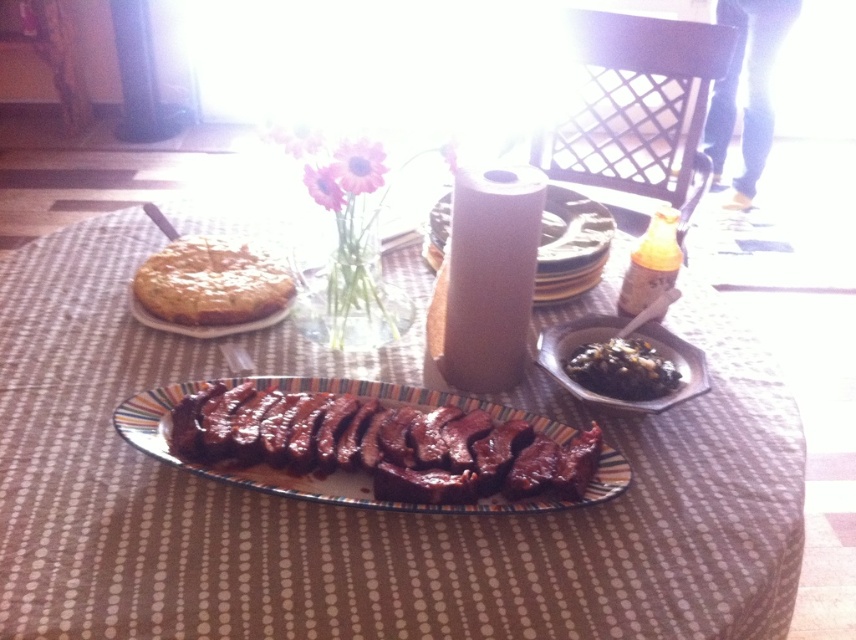
Who is more distant from viewer, [428,508] or [223,282]?

Positioned behind is point [223,282].

Image resolution: width=856 pixels, height=640 pixels. Describe the element at coordinates (334, 472) in the screenshot. I see `glossy ceramic platter at center` at that location.

Locate an element on the screen. glossy ceramic platter at center is located at coordinates (334, 472).

Is point (676, 337) in front of point (223, 332)?

That is True.

Who is more forward, (590, 340) or (146, 323)?

Positioned in front is point (590, 340).

Where is `black glossy bowl at center`? The height and width of the screenshot is (640, 856). black glossy bowl at center is located at coordinates (629, 337).

Where is `smokey brown meat at center`? This screenshot has height=640, width=856. smokey brown meat at center is located at coordinates (367, 509).

Is smokey brown meat at center below black glossy sauce at center?

Yes, smokey brown meat at center is below black glossy sauce at center.

The width and height of the screenshot is (856, 640). I want to click on smokey brown meat at center, so click(x=367, y=509).